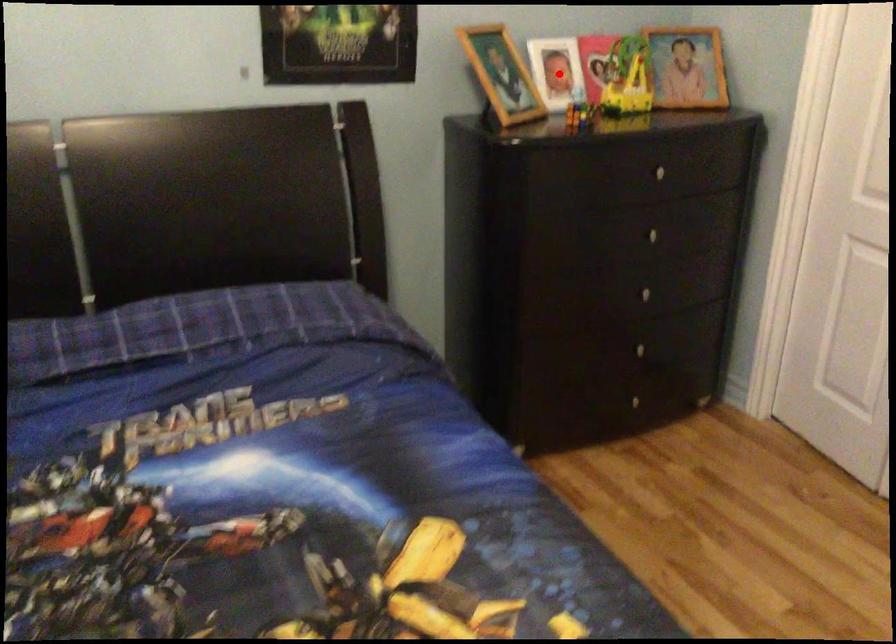
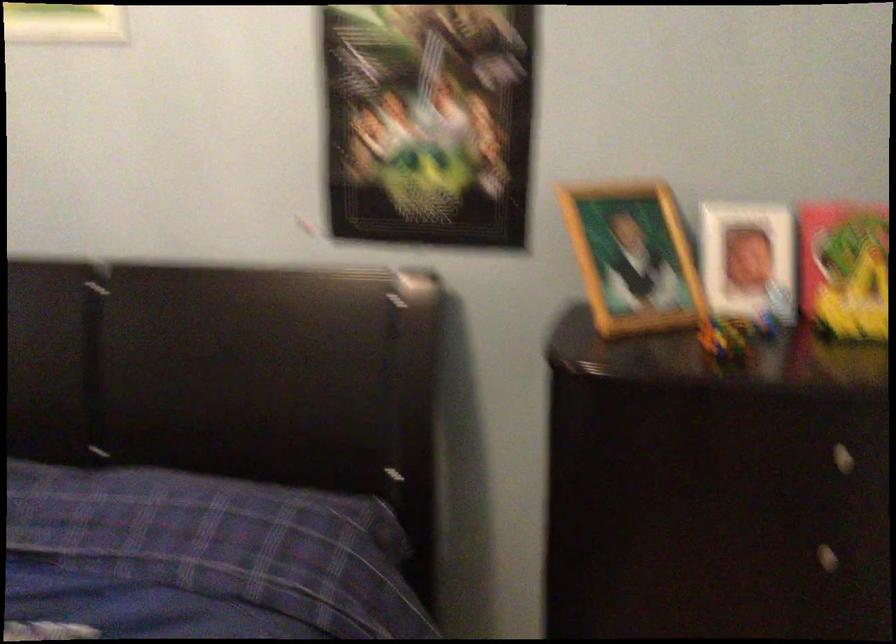
Question: I am providing you with two images of the same scene from different viewpoints. Image1 has a red point marked. In image2, the corresponding 3D location appears at what relative position? Reply with the corresponding letter.

Choices:
 (A) Closer
 (B) Farther

Answer: (A)